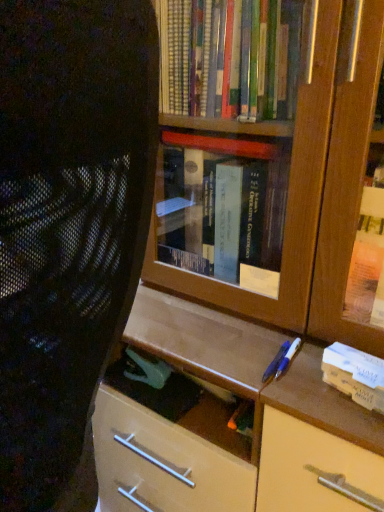
Question: Should I look upward or downward to see white cardboard book at right?

Choices:
 (A) down
 (B) up

Answer: (A)

Question: Can you confirm if black mesh chair at left is bigger than white cardboard book at right?

Choices:
 (A) no
 (B) yes

Answer: (B)

Question: Is black mesh chair at left facing towards white cardboard book at right?

Choices:
 (A) no
 (B) yes

Answer: (A)

Question: Is black mesh chair at left outside of white cardboard book at right?

Choices:
 (A) yes
 (B) no

Answer: (A)

Question: From a real-world perspective, is black mesh chair at left positioned over white cardboard book at right based on gravity?

Choices:
 (A) yes
 (B) no

Answer: (A)

Question: Is black mesh chair at left closer to camera compared to white cardboard book at right?

Choices:
 (A) no
 (B) yes

Answer: (B)

Question: Is black mesh chair at left to the left of white cardboard book at right from the viewer's perspective?

Choices:
 (A) yes
 (B) no

Answer: (A)

Question: Considering the relative positions of white cardboard book at right and black mesh chair at left in the image provided, is white cardboard book at right to the right of black mesh chair at left from the viewer's perspective?

Choices:
 (A) no
 (B) yes

Answer: (B)

Question: Can you confirm if white cardboard book at right is thinner than black mesh chair at left?

Choices:
 (A) yes
 (B) no

Answer: (A)

Question: Is white cardboard book at right located outside black mesh chair at left?

Choices:
 (A) no
 (B) yes

Answer: (B)

Question: Is white cardboard book at right beside black mesh chair at left?

Choices:
 (A) no
 (B) yes

Answer: (A)

Question: Considering the relative sizes of white cardboard book at right and black mesh chair at left in the image provided, is white cardboard book at right wider than black mesh chair at left?

Choices:
 (A) no
 (B) yes

Answer: (A)

Question: Is white cardboard book at right at the left side of black mesh chair at left?

Choices:
 (A) no
 (B) yes

Answer: (A)

Question: Which is correct: black mesh chair at left is inside white cardboard book at right, or outside of it?

Choices:
 (A) inside
 (B) outside

Answer: (B)